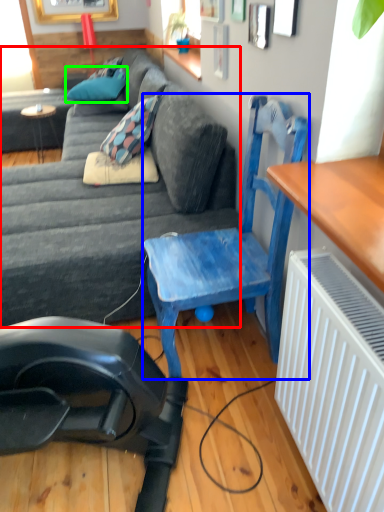
Question: Considering the real-world distances, which object is farthest from studio couch (highlighted by a red box)? chair (highlighted by a blue box) or pillow (highlighted by a green box)?

Choices:
 (A) chair
 (B) pillow

Answer: (B)